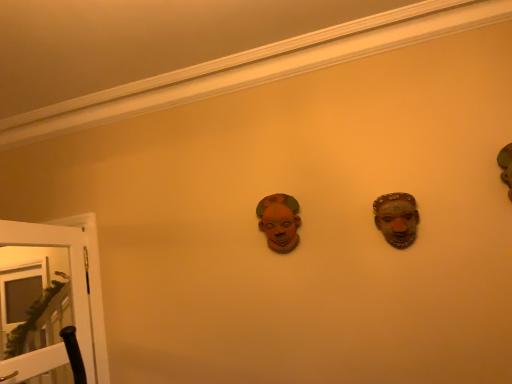
Question: Is matte brown mask at center in front of or behind white glossy door at lower left in the image?

Choices:
 (A) behind
 (B) front

Answer: (A)

Question: Choose the correct answer: Is matte brown mask at center inside white glossy door at lower left or outside it?

Choices:
 (A) outside
 (B) inside

Answer: (A)

Question: Considering the positions of point (283, 249) and point (30, 249), is point (283, 249) closer or farther from the camera than point (30, 249)?

Choices:
 (A) closer
 (B) farther

Answer: (A)

Question: Is white glossy door at lower left to the left or to the right of matte brown mask at center in the image?

Choices:
 (A) right
 (B) left

Answer: (B)

Question: Relative to matte brown mask at center, is white glossy door at lower left in front or behind?

Choices:
 (A) behind
 (B) front

Answer: (B)

Question: From the image's perspective, is white glossy door at lower left located above or below matte brown mask at center?

Choices:
 (A) below
 (B) above

Answer: (A)

Question: Would you say white glossy door at lower left is inside or outside matte brown mask at center?

Choices:
 (A) inside
 (B) outside

Answer: (B)